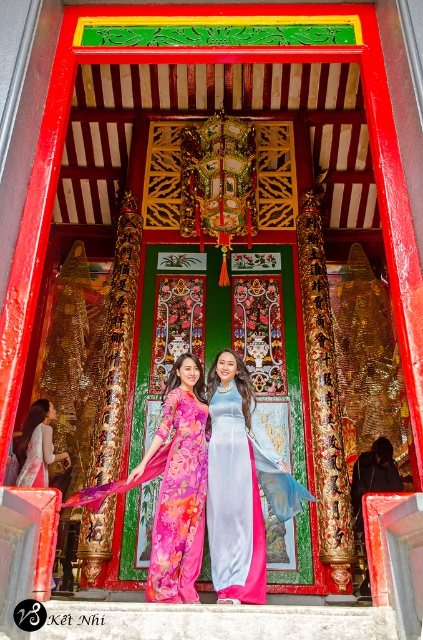
Is pink silk ao dai at center taller than pink satin dress at center?

Indeed, pink silk ao dai at center has a greater height compared to pink satin dress at center.

Who is positioned more to the right, pink silk ao dai at center or pink satin dress at center?

Positioned to the right is pink satin dress at center.

Is point (41, 410) closer to viewer compared to point (25, 481)?

No, it is behind (25, 481).

Image resolution: width=423 pixels, height=640 pixels. Identify the location of pink silk ao dai at center. (38, 445).

Is floral silk dress at center above pink silk ao dai at center?

Yes.

Who is higher up, floral silk dress at center or pink silk ao dai at center?

floral silk dress at center is higher up.

Where is `floral silk dress at center`? The height and width of the screenshot is (640, 423). floral silk dress at center is located at coordinates (178, 499).

The image size is (423, 640). Identify the location of floral silk dress at center. (178, 499).

Can you confirm if floral silk dress at center is positioned to the left of pink satin dress at center?

Incorrect, floral silk dress at center is not on the left side of pink satin dress at center.

Is point (197, 508) farther from camera compared to point (22, 470)?

No, it is in front of (22, 470).

This screenshot has height=640, width=423. I want to click on floral silk dress at center, so click(178, 499).